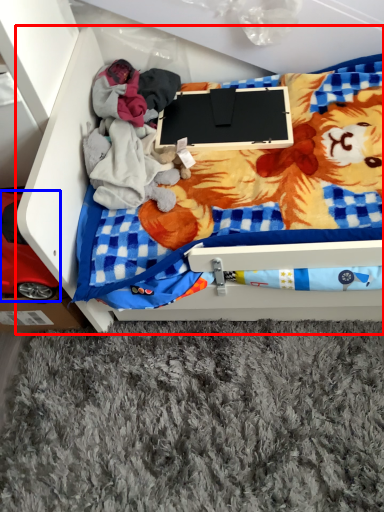
Question: Among these objects, which one is farthest to the camera, furniture (highlighted by a red box) or toy (highlighted by a blue box)?

Choices:
 (A) furniture
 (B) toy

Answer: (B)